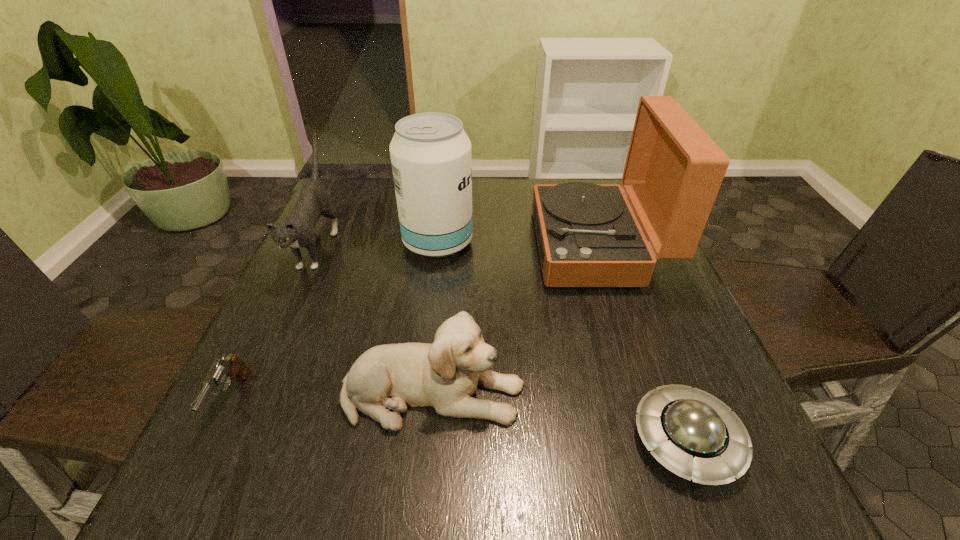
Where is `vacant space located at the face of the cat`? The image size is (960, 540). vacant space located at the face of the cat is located at coordinates (275, 338).

Locate an element on the screen. The width and height of the screenshot is (960, 540). free point located on the front-facing side of the puppy is located at coordinates (687, 394).

Where is `vacant space situated 0.090m at the barrel of the pistol`? This screenshot has height=540, width=960. vacant space situated 0.090m at the barrel of the pistol is located at coordinates (185, 494).

Where is `vacant space located on the left of the saucer`? This screenshot has width=960, height=540. vacant space located on the left of the saucer is located at coordinates (444, 440).

At what (x,y) coordinates should I click in order to perform the action: click on phonograph record positioned at the far edge. Please return your answer as a coordinate pair (x, y). This screenshot has height=540, width=960. Looking at the image, I should click on (588, 236).

At what (x,y) coordinates should I click in order to perform the action: click on cat present at the far edge. Please return your answer as a coordinate pair (x, y). Image resolution: width=960 pixels, height=540 pixels. Looking at the image, I should click on (297, 230).

Identify the location of object located in the near edge section of the desktop. (693, 434).

Image resolution: width=960 pixels, height=540 pixels. What are the coordinates of `cat that is at the left edge` in the screenshot? It's located at (297, 230).

Where is `pistol present at the left edge`? The image size is (960, 540). pistol present at the left edge is located at coordinates (229, 368).

This screenshot has width=960, height=540. What are the coordinates of `phonograph record positioned at the right edge` in the screenshot? It's located at [x=588, y=236].